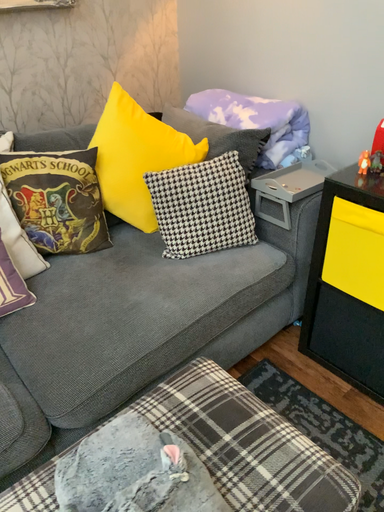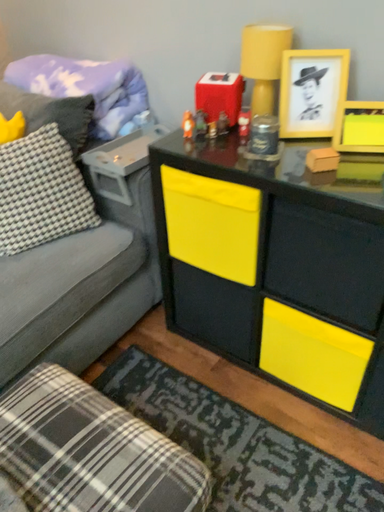
Question: How did the camera likely rotate when shooting the video?

Choices:
 (A) rotated right
 (B) rotated left

Answer: (A)